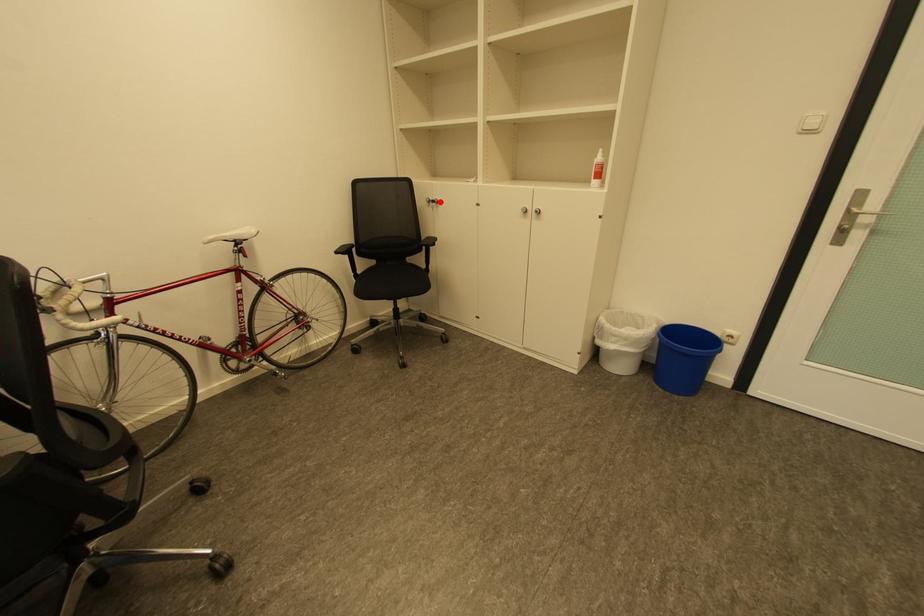
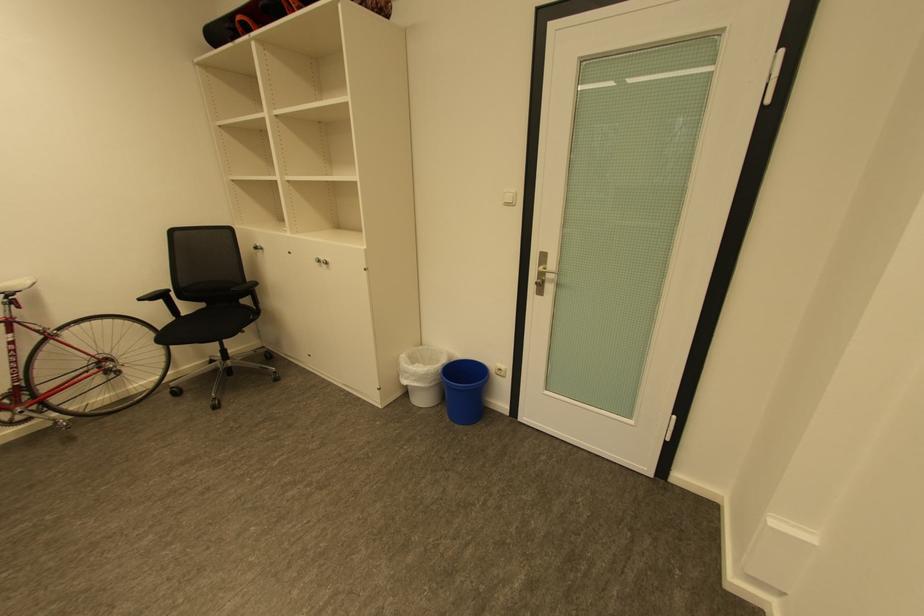
Locate, in the second image, the point that corresponds to the highlighted location in the first image.

(262, 248)